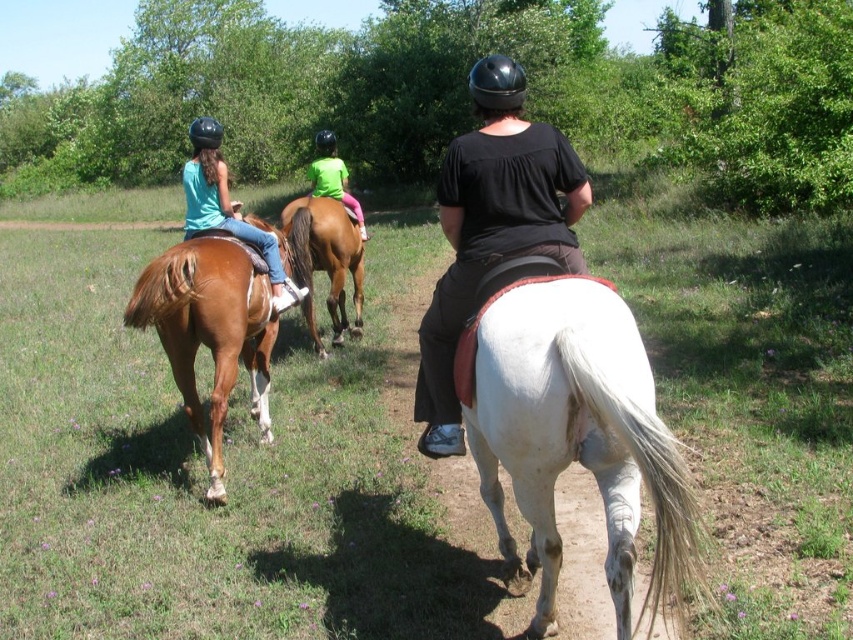
Does white smooth horse at center have a greater height compared to black matte shirt at center?

Yes, white smooth horse at center is taller than black matte shirt at center.

How far apart are white smooth horse at center and black matte shirt at center?

32.69 inches

Image resolution: width=853 pixels, height=640 pixels. I want to click on white smooth horse at center, so click(573, 435).

Locate an element on the screen. The image size is (853, 640). white smooth horse at center is located at coordinates (573, 435).

Find the location of a particular element. white matte horse at center is located at coordinates (227, 465).

Does white matte horse at center appear over black matte shirt at center?

Correct, white matte horse at center is located above black matte shirt at center.

Is point (740, 273) positioned behind point (561, 148)?

Yes, point (740, 273) is behind point (561, 148).

I want to click on white matte horse at center, so click(x=227, y=465).

How much distance is there between white matte horse at center and brown glossy horse at left?

3.63 meters

This screenshot has height=640, width=853. I want to click on white matte horse at center, so click(227, 465).